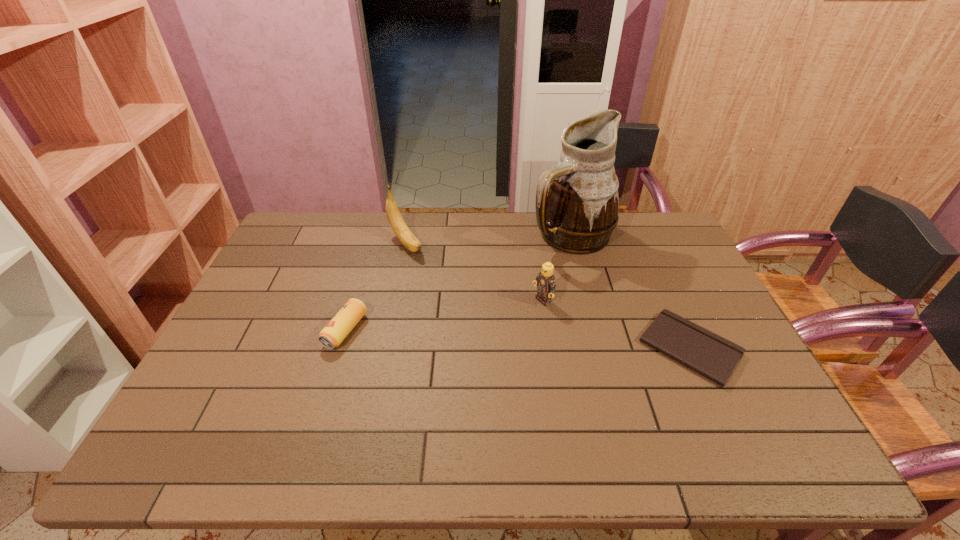
Locate an element on the screen. free spot on the desktop that is between the beer can and the shortest object and is positioned at the start of the peel on the second tallest object is located at coordinates (501, 339).

Where is `free space on the desktop that is between the beer can and the shortest object and is positioned in front of the third tallest object`? The width and height of the screenshot is (960, 540). free space on the desktop that is between the beer can and the shortest object and is positioned in front of the third tallest object is located at coordinates (479, 338).

In order to click on vacant space on the desktop that is between the beer can and the shortest object and is positioned from the spout of the tallest object in this screenshot , I will do `click(558, 341)`.